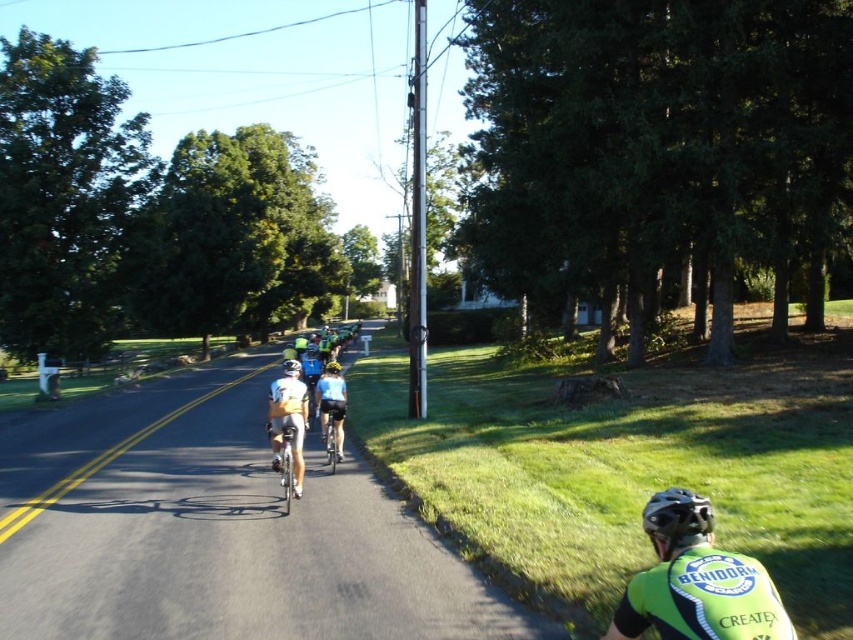
Question: From the image, what is the correct spatial relationship of yellow jersey at center in relation to yellow matte helmet at center?

Choices:
 (A) below
 (B) above

Answer: (A)

Question: Does shiny blue bicycle at center have a larger size compared to matte yellow helmet at center?

Choices:
 (A) yes
 (B) no

Answer: (B)

Question: Which of the following is the farthest from the observer?

Choices:
 (A) light blue jersey at center
 (B) matte yellow helmet at center

Answer: (A)

Question: Considering the real-world distances, which object is closest to the yellow jersey at center?

Choices:
 (A) shiny silver bicycle at center
 (B) green jersey at center

Answer: (A)

Question: Is green jersey at center positioned behind yellow matte helmet at center?

Choices:
 (A) no
 (B) yes

Answer: (A)

Question: Which object is closer to the camera taking this photo?

Choices:
 (A) green jersey at center
 (B) light blue jersey at center

Answer: (A)